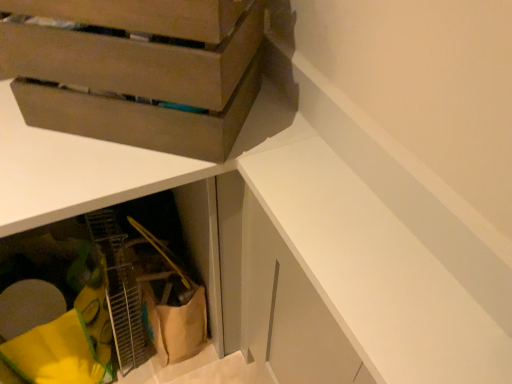
Question: Looking at their shapes, would you say yellow fabric at lower left, acting as the 2th cabinetry starting from the right, is wider or thinner than matte brown cardboard box at upper left?

Choices:
 (A) thin
 (B) wide

Answer: (B)

Question: Is point (135, 210) positioned closer to the camera than point (22, 97)?

Choices:
 (A) farther
 (B) closer

Answer: (A)

Question: Which of these objects is positioned farthest from the yellow fabric at lower left, positioned as the 1th cabinetry in left-to-right order?

Choices:
 (A) white matte cabinet at upper right, which is the 2th cabinetry from left to right
 (B) matte brown cardboard box at upper left

Answer: (A)

Question: Estimate the real-world distances between objects in this image. Which object is farther from the matte brown cardboard box at upper left?

Choices:
 (A) white matte cabinet at upper right, arranged as the 2th cabinetry when viewed from the back
 (B) yellow fabric at lower left, which appears as the 2th cabinetry when viewed from the front

Answer: (B)